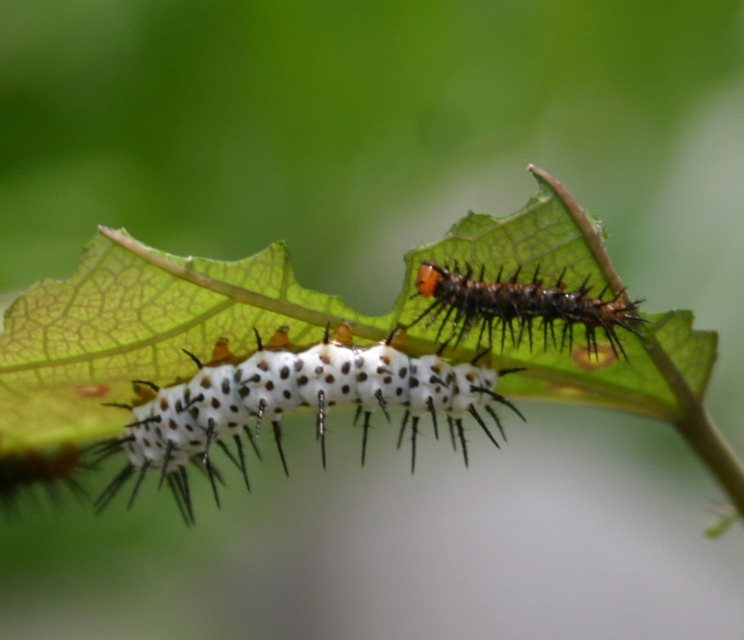
Between point (266, 348) and point (513, 280), which one is positioned behind?

Point (266, 348)

In the scene shown: Who is more distant from viewer, (341, 394) or (434, 262)?

The point (341, 394) is behind.

This screenshot has height=640, width=744. I want to click on white spiny caterpillar at center, so click(289, 404).